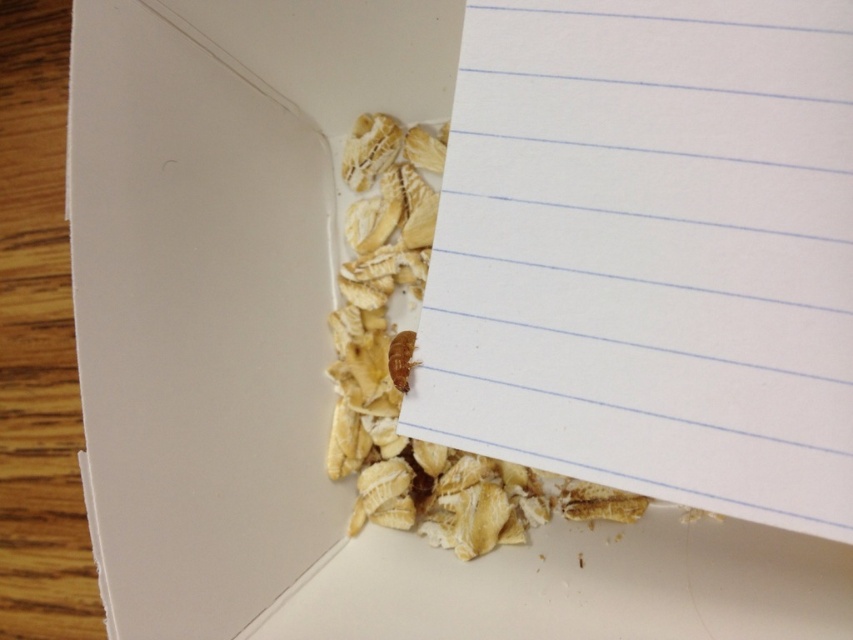
You are packing a gift and need to place the white lined paper at center and the brown crumb at lower center inside a small container. Based on their positions in the box, which object should you move first to ensure proper placement?

The white lined paper at center should be moved first because it is positioned to the left of the brown crumb at lower center, so moving it first allows the brown crumb to be placed correctly without obstruction.

You are a quality inspector checking this box of oatmeal. You notice the white lined paper at center and the brown crumb at lower center. Which object is nearer to you?

The white lined paper at center is closer to the viewer than the brown crumb at lower center.

You are packing a gift and need to place both the white lined paper at center and the light brown paper at upper right into a small envelope. Which paper should you choose to fit better based on their height?

The white lined paper at center has a lesser height compared to the light brown paper at upper right, so the white lined paper at center will fit better into the small envelope.